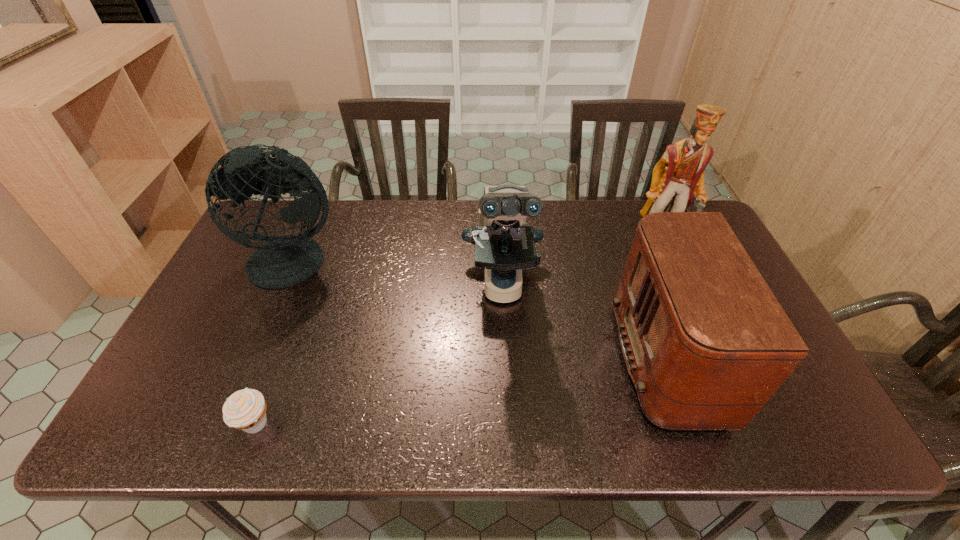
The height and width of the screenshot is (540, 960). Find the location of `vacant point located on the front panel of the second shortest object`. vacant point located on the front panel of the second shortest object is located at coordinates (520, 360).

Where is `vacant space located 0.250m on the back of the muffin`? vacant space located 0.250m on the back of the muffin is located at coordinates (295, 321).

Where is `nutcracker that is at the far edge`? nutcracker that is at the far edge is located at coordinates (678, 177).

This screenshot has height=540, width=960. Identify the location of microscope that is at the far edge. (504, 245).

At what (x,y) coordinates should I click in order to perform the action: click on globe that is at the far edge. Please return your answer as a coordinate pair (x, y). The width and height of the screenshot is (960, 540). Looking at the image, I should click on (284, 261).

Where is `radio receiver present at the near edge`? This screenshot has height=540, width=960. radio receiver present at the near edge is located at coordinates (706, 343).

Where is `muffin that is at the near edge`? muffin that is at the near edge is located at coordinates (245, 410).

Where is `object positioned at the left edge`? The image size is (960, 540). object positioned at the left edge is located at coordinates (284, 261).

Locate an element on the screen. Image resolution: width=960 pixels, height=540 pixels. nutcracker at the right edge is located at coordinates (678, 177).

Find the location of a particular element. The height and width of the screenshot is (540, 960). radio receiver positioned at the right edge is located at coordinates (706, 343).